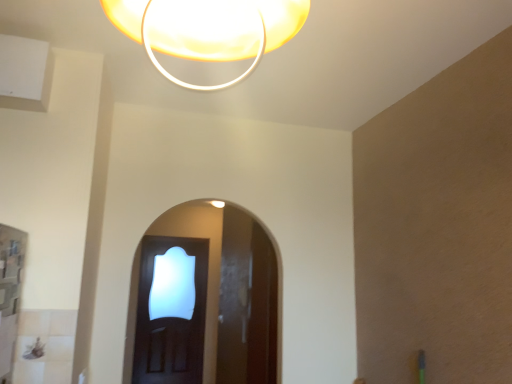
The image size is (512, 384). What do you see at coordinates (170, 319) in the screenshot?
I see `transparent glass door at center` at bounding box center [170, 319].

What is the approximate height of transparent glass door at center?

It is 2.01 meters.

You are a GUI agent. You are given a task and a screenshot of the screen. Output one action in this format:
    pyautogui.click(x=<x>, y=<y>)
    Task: Click on the transparent glass door at center
    The height and width of the screenshot is (384, 512).
    Given the screenshot: What is the action you would take?
    pyautogui.click(x=170, y=319)

At what (x,y) coordinates should I click in order to perform the action: click on transparent glass door at center. Please return your answer as a coordinate pair (x, y). The width and height of the screenshot is (512, 384). Looking at the image, I should click on (170, 319).